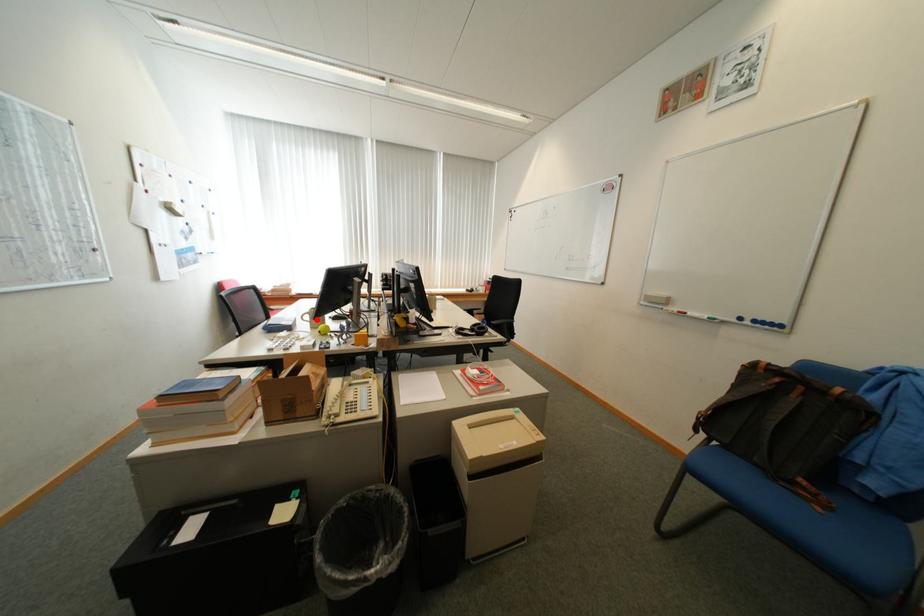
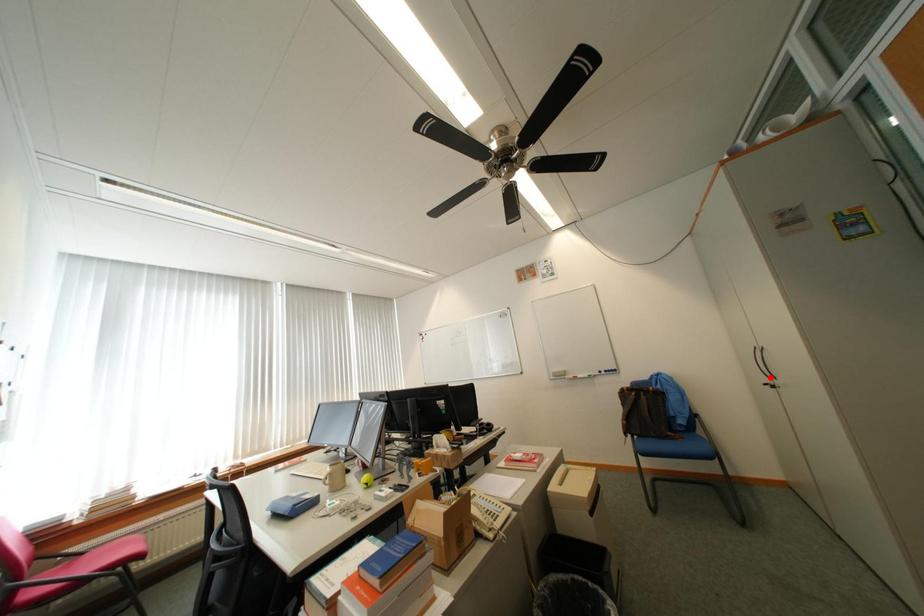
I am providing you with two images of the same scene from different viewpoints. A red point is marked on the first image and another point is marked on the second image. Is the marked point in image1 the same physical position as the marked point in image2?

No